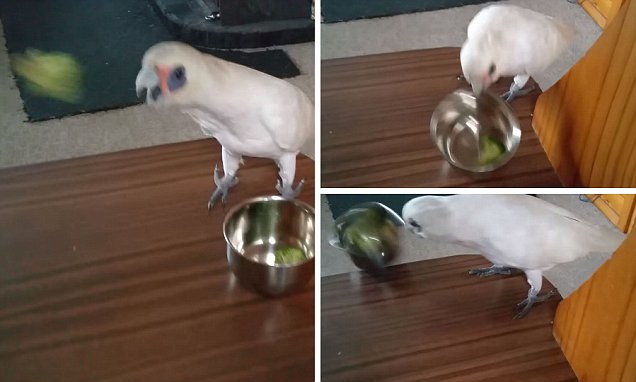
The height and width of the screenshot is (382, 636). What are the coordinates of `black rug` in the screenshot? It's located at (113, 91).